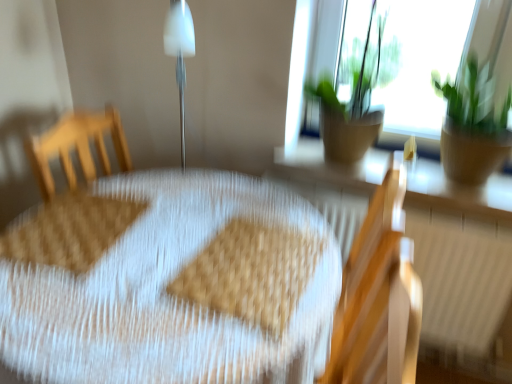
Question: Does brown textured pot at upper right, marked as the second houseplant in a right-to-left arrangement, contain wooden radiator at lower right?

Choices:
 (A) yes
 (B) no

Answer: (B)

Question: Does brown textured pot at upper right, which appears as the 1th houseplant when viewed from the left, have a lesser width compared to wooden radiator at lower right?

Choices:
 (A) no
 (B) yes

Answer: (A)

Question: Is brown textured pot at upper right, which appears as the 1th houseplant when viewed from the left, next to wooden radiator at lower right and touching it?

Choices:
 (A) yes
 (B) no

Answer: (B)

Question: Does brown textured pot at upper right, marked as the second houseplant in a right-to-left arrangement, have a greater height compared to wooden radiator at lower right?

Choices:
 (A) no
 (B) yes

Answer: (A)

Question: Is the position of brown textured pot at upper right, which appears as the 1th houseplant when viewed from the left, less distant than that of wooden radiator at lower right?

Choices:
 (A) yes
 (B) no

Answer: (A)

Question: Would you say brown textured pot at upper right, marked as the second houseplant in a right-to-left arrangement, is outside wooden radiator at lower right?

Choices:
 (A) no
 (B) yes

Answer: (B)

Question: From the image's perspective, does matte brown wood at upper right appear higher than wooden radiator at lower right?

Choices:
 (A) yes
 (B) no

Answer: (A)

Question: Would you say matte brown wood at upper right contains wooden radiator at lower right?

Choices:
 (A) no
 (B) yes

Answer: (A)

Question: Does matte brown wood at upper right appear on the right side of wooden radiator at lower right?

Choices:
 (A) yes
 (B) no

Answer: (B)

Question: Is matte brown wood at upper right completely or partially outside of wooden radiator at lower right?

Choices:
 (A) yes
 (B) no

Answer: (A)

Question: Does matte brown wood at upper right have a lesser height compared to wooden radiator at lower right?

Choices:
 (A) no
 (B) yes

Answer: (B)

Question: Is matte brown wood at upper right looking in the opposite direction of wooden radiator at lower right?

Choices:
 (A) yes
 (B) no

Answer: (B)

Question: Can you confirm if brown textured pot at upper right, which appears as the 1th houseplant when viewed from the left, is bigger than wooden chair at right?

Choices:
 (A) yes
 (B) no

Answer: (B)